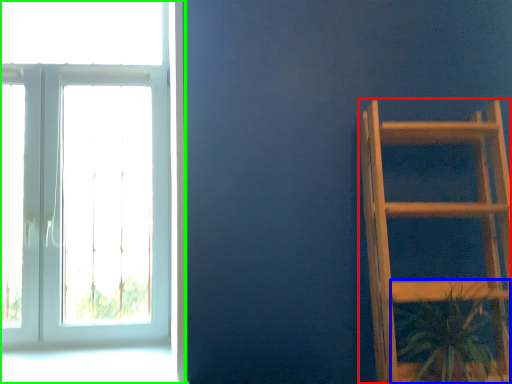
Question: Which is farther away from furniture (highlighted by a red box)? houseplant (highlighted by a blue box) or window (highlighted by a green box)?

Choices:
 (A) houseplant
 (B) window

Answer: (B)